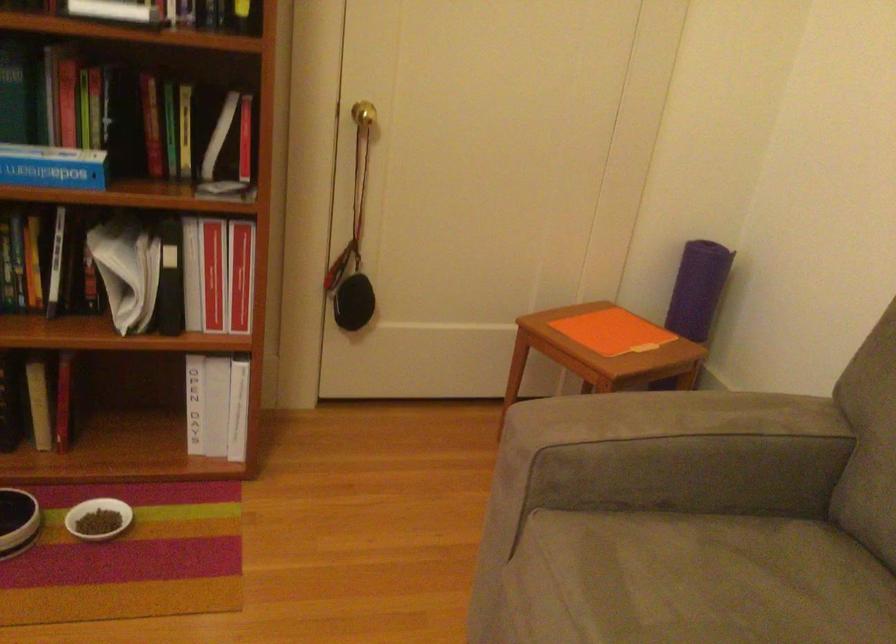
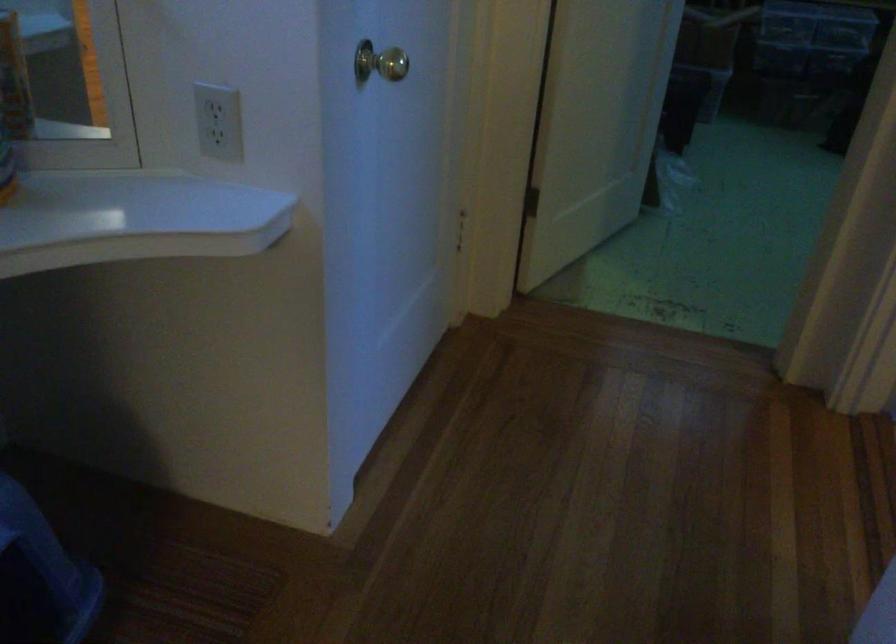
Which direction would the cameraman need to move to produce the second image?

The movement direction of the cameraman is left, forward.